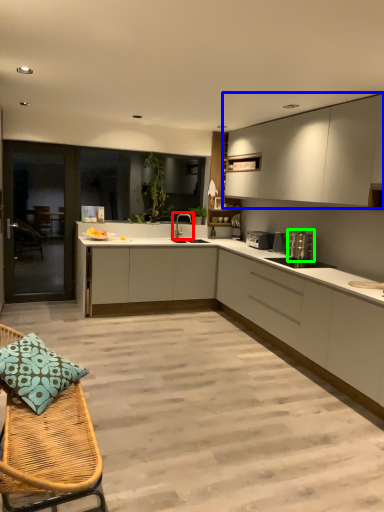
Question: Considering the real-world distances, which object is farthest from tap (highlighted by a red box)? cabinetry (highlighted by a blue box) or appliance (highlighted by a green box)?

Choices:
 (A) cabinetry
 (B) appliance

Answer: (A)